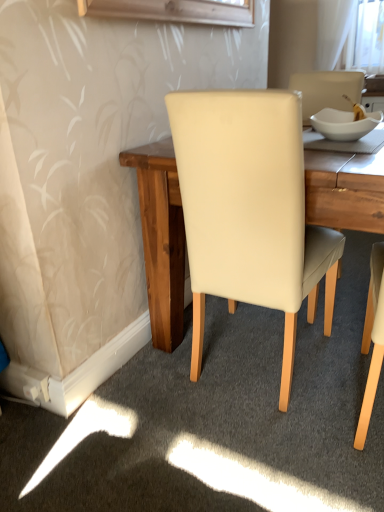
The image size is (384, 512). What are the coordinates of `free point in front of white glossy bowl at upper right` in the screenshot? It's located at (340, 157).